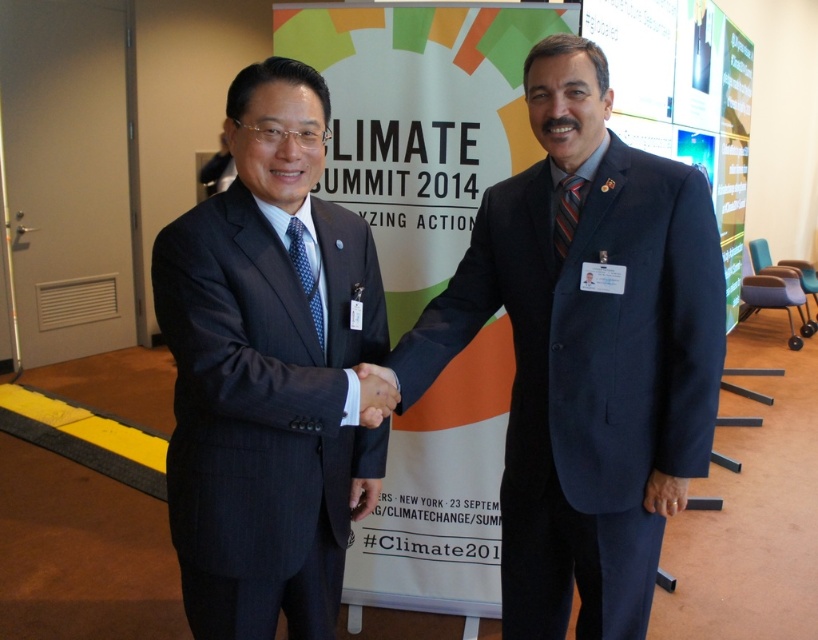
You are a photographer at the Climate Summit 2014. You need to capture a closeup shot of the ties worn by the two men shaking hands. Which tie, the blue dotted tie at center or the striped silk tie at right, will appear larger in the photo?

The blue dotted tie at center will appear larger in the photo because it has a greater height compared to the striped silk tie at right.

You are a photographer at the Climate Summit 2014. You need to capture a closeup shot of both the black smooth hand at center and the blue dotted tie at center. Which object should you zoom in on first to ensure it fits within your camera frame?

The black smooth hand at center is wider than the blue dotted tie at center, so you should zoom in on the black smooth hand at center first to ensure it fits within the camera frame before adjusting for the narrower blue dotted tie at center.

Looking at the image of the Climate Summit 2014, there are two men shaking hands. You notice a black smooth hand at center and a blue dotted tie at center. Which object is positioned to the right of the other?

The black smooth hand at center is to the right of the blue dotted tie at center.